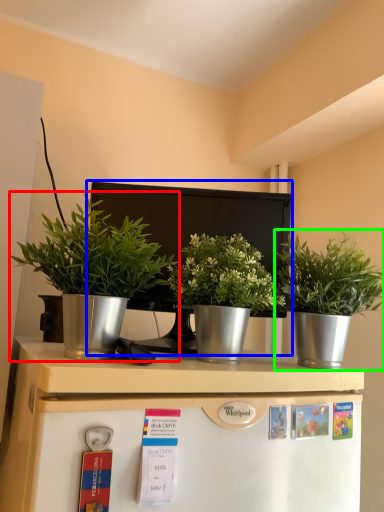
Question: Which object is the closest to the houseplant (highlighted by a red box)? Choose among these: appliance (highlighted by a blue box) or houseplant (highlighted by a green box).

Choices:
 (A) appliance
 (B) houseplant

Answer: (A)